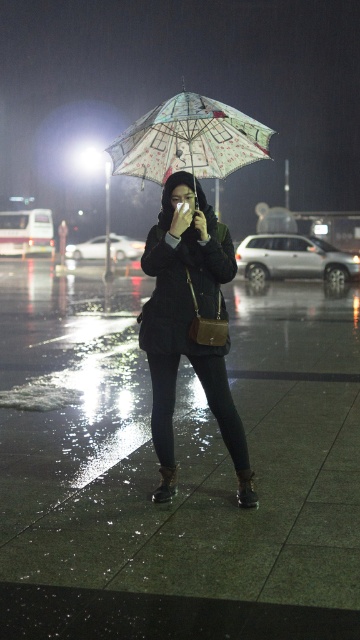
Which is more to the left, glossy concrete pavement at center or dark matte jacket at center?

dark matte jacket at center

Who is taller, glossy concrete pavement at center or dark matte jacket at center?

Standing taller between the two is dark matte jacket at center.

Who is more distant from viewer, [140,496] or [200,269]?

Positioned behind is point [200,269].

Locate an element on the screen. glossy concrete pavement at center is located at coordinates (178, 470).

Is dark matte jacket at center above patterned fabric umbrella at center?

No.

Which is in front, point (186, 221) or point (151, 136)?

Point (186, 221) is in front.

At what (x,y) coordinates should I click in order to perform the action: click on dark matte jacket at center. Please return your answer as a coordinate pair (x, y). The width and height of the screenshot is (360, 640). Looking at the image, I should click on (189, 323).

At what (x,y) coordinates should I click in order to perform the action: click on dark matte jacket at center. Please return your answer as a coordinate pair (x, y). The height and width of the screenshot is (640, 360). Looking at the image, I should click on [x=189, y=323].

Can you confirm if glossy concrete pavement at center is positioned to the right of patterned fabric umbrella at center?

Correct, you'll find glossy concrete pavement at center to the right of patterned fabric umbrella at center.

Is glossy concrete pavement at center positioned behind patterned fabric umbrella at center?

No.

Who is more distant from viewer, (16, 401) or (138, 163)?

Positioned behind is point (16, 401).

At what (x,y) coordinates should I click in order to perform the action: click on glossy concrete pavement at center. Please return your answer as a coordinate pair (x, y). The width and height of the screenshot is (360, 640). Looking at the image, I should click on (178, 470).